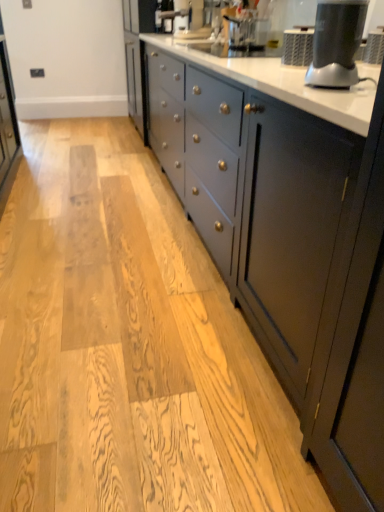
Question: Is matte black blender at upper right completely or partially outside of white glossy countertop at center?

Choices:
 (A) no
 (B) yes

Answer: (A)

Question: Is matte black blender at upper right far from white glossy countertop at center?

Choices:
 (A) no
 (B) yes

Answer: (A)

Question: Can you confirm if matte black blender at upper right is smaller than white glossy countertop at center?

Choices:
 (A) yes
 (B) no

Answer: (A)

Question: Is white glossy countertop at center at the back of matte black blender at upper right?

Choices:
 (A) yes
 (B) no

Answer: (B)

Question: Is matte black blender at upper right taller than white glossy countertop at center?

Choices:
 (A) yes
 (B) no

Answer: (B)

Question: From a real-world perspective, is matte black blender at upper right under white glossy countertop at center?

Choices:
 (A) yes
 (B) no

Answer: (B)

Question: Is matte black coffee machine at upper center to the left of matte black blender at upper right from the viewer's perspective?

Choices:
 (A) yes
 (B) no

Answer: (A)

Question: From the image's perspective, is matte black coffee machine at upper center located above matte black blender at upper right?

Choices:
 (A) no
 (B) yes

Answer: (B)

Question: Is matte black coffee machine at upper center far away from matte black blender at upper right?

Choices:
 (A) no
 (B) yes

Answer: (B)

Question: Is matte black coffee machine at upper center directly adjacent to matte black blender at upper right?

Choices:
 (A) yes
 (B) no

Answer: (B)

Question: From a real-world perspective, is matte black coffee machine at upper center over matte black blender at upper right?

Choices:
 (A) yes
 (B) no

Answer: (A)

Question: Is matte black coffee machine at upper center outside of matte black blender at upper right?

Choices:
 (A) no
 (B) yes

Answer: (B)

Question: Is white glossy countertop at center taller than matte black blender at upper right?

Choices:
 (A) no
 (B) yes

Answer: (B)